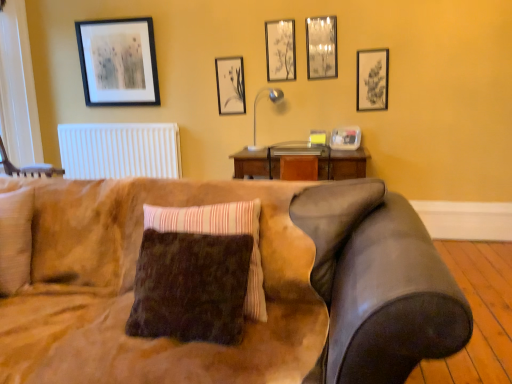
Question: Do you think black matte picture frame at upper left, arranged as the 6th picture frame when viewed from the right, is within clear plastic container at upper right, the second picture frame from the right, or outside of it?

Choices:
 (A) inside
 (B) outside

Answer: (B)

Question: Is point (121, 59) positioned closer to the camera than point (338, 132)?

Choices:
 (A) farther
 (B) closer

Answer: (A)

Question: Which object is the closest to the matte black picture frame at upper center, the 3th picture frame when ordered from left to right?

Choices:
 (A) white matte radiator at upper left
 (B) matte black picture frame at upper right, which appears as the 1th picture frame when viewed from the right
 (C) brown fuzzy pillow at center
 (D) clear plastic container at upper right, the second picture frame from the right
 (E) black matte picture frame at upper left, arranged as the 6th picture frame when viewed from the right

Answer: (B)

Question: Which object is positioned farthest from the metallic mirror at upper center, which is the 4th picture frame from left to right?

Choices:
 (A) matte black picture frame at upper center, the 2th picture frame positioned from the left
 (B) suede couch at center
 (C) matte black picture frame at upper right, which appears as the 1th picture frame when viewed from the right
 (D) clear plastic container at upper right, the second picture frame from the right
 (E) brown fuzzy pillow at center

Answer: (B)